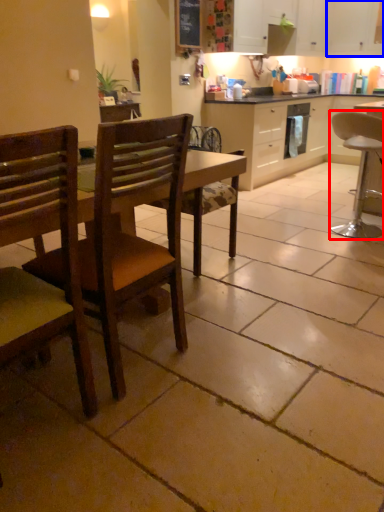
Question: Which object is further to the camera taking this photo, chair (highlighted by a red box) or cabinetry (highlighted by a blue box)?

Choices:
 (A) chair
 (B) cabinetry

Answer: (B)